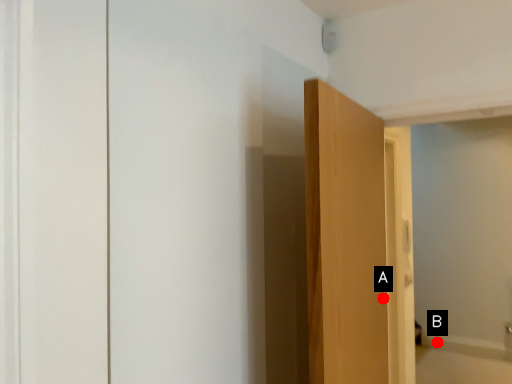
Question: Two points are circled on the image, labeled by A and B beside each circle. Which point is further to the camera?

Choices:
 (A) A is further
 (B) B is further

Answer: (B)